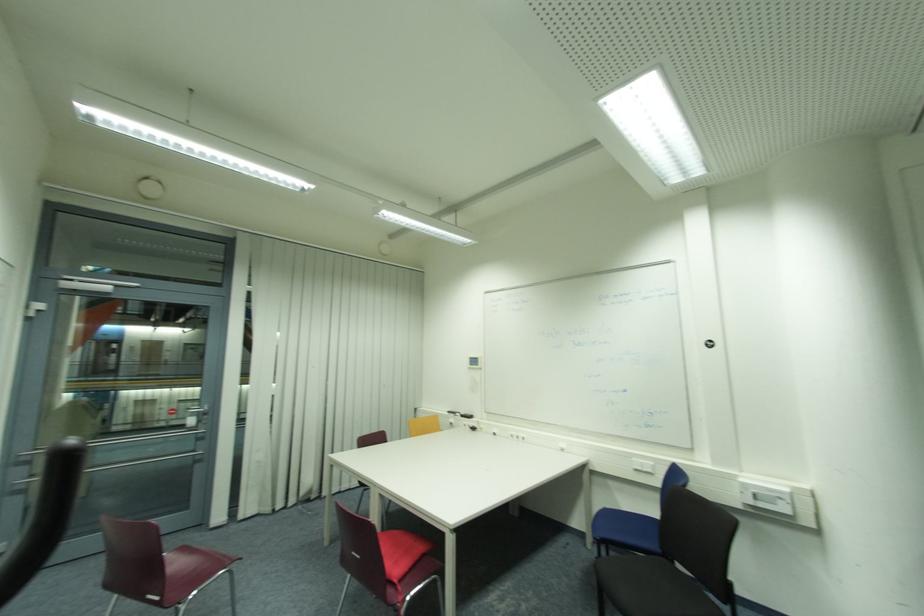
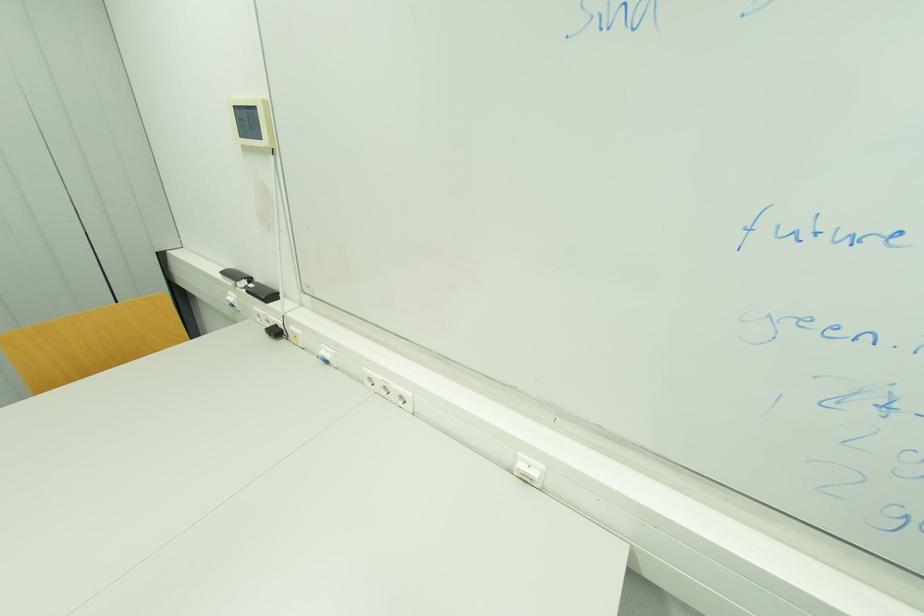
In the second image, find the point that corresponds to point (475, 359) in the first image.

(237, 108)